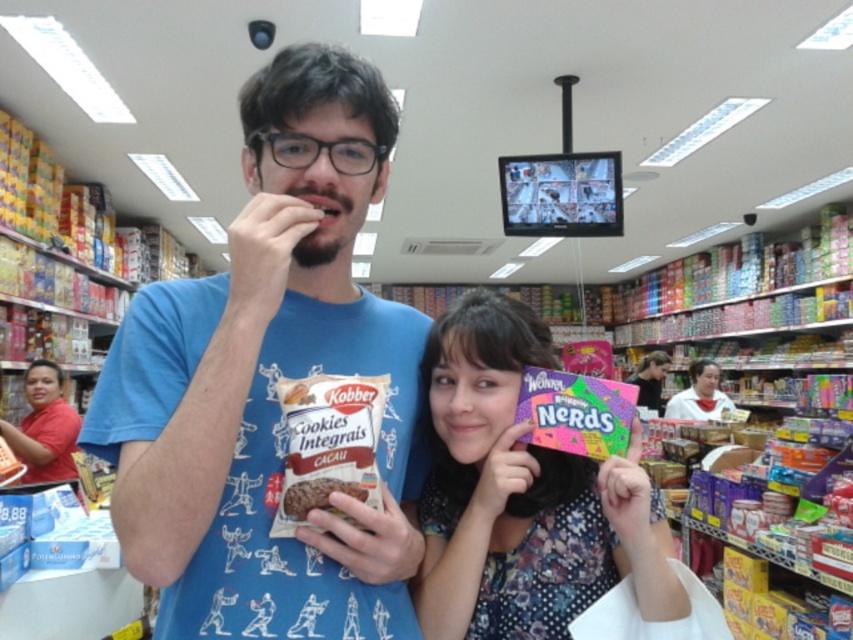
You are standing at the entrance of the store and see two points in the image. Which point is closer to you, point (695, 369) or point (305, 506)?

Point (305, 506) is closer to you because the description states that point (695, 369) is further to the camera than point (305, 506).

You are a store employee who needs to place a new display between the blue cotton shirt at center and the red shirt at lower left. Which shirt should you place closer to the center of the store to ensure the display is balanced?

The blue cotton shirt at center is smaller than the red shirt at lower left, so to balance the display, the larger red shirt at lower left should be placed closer to the center of the store to compensate for its size.

You are a store employee who needs to hand a customer a product located behind the blue cotton shirt at center and the red shirt at lower left. Which person should you ask to move first?

Answer: You should ask the blue cotton shirt at center to move first because it is in front of the red shirt at lower left, so moving it first would allow access to the area behind both.